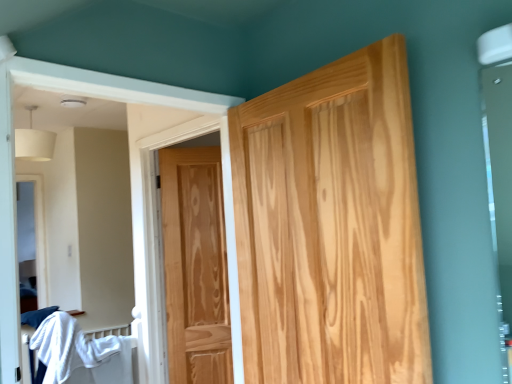
Question: In terms of height, does white cotton bed at lower left look taller or shorter compared to natural wood door at center, the first door viewed from the right?

Choices:
 (A) short
 (B) tall

Answer: (A)

Question: Is point (58, 334) closer or farther from the camera than point (246, 190)?

Choices:
 (A) closer
 (B) farther

Answer: (B)

Question: Estimate the real-world distances between objects in this image. Which object is closer to the natural wood door at center, positioned as the second door in front-to-back order?

Choices:
 (A) natural wood door at center, the first door viewed from the right
 (B) white cotton bed at lower left

Answer: (B)

Question: Estimate the real-world distances between objects in this image. Which object is closer to the white cotton bed at lower left?

Choices:
 (A) natural wood door at center, positioned as the second door in front-to-back order
 (B) natural wood door at center, marked as the 2th door in a back-to-front arrangement

Answer: (A)